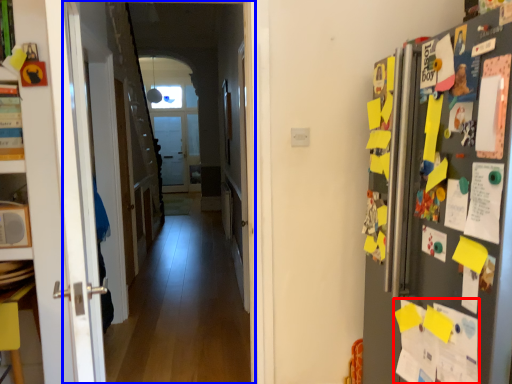
Question: Which object appears farthest to the camera in this image, paper (highlighted by a red box) or corridor (highlighted by a blue box)?

Choices:
 (A) paper
 (B) corridor

Answer: (B)